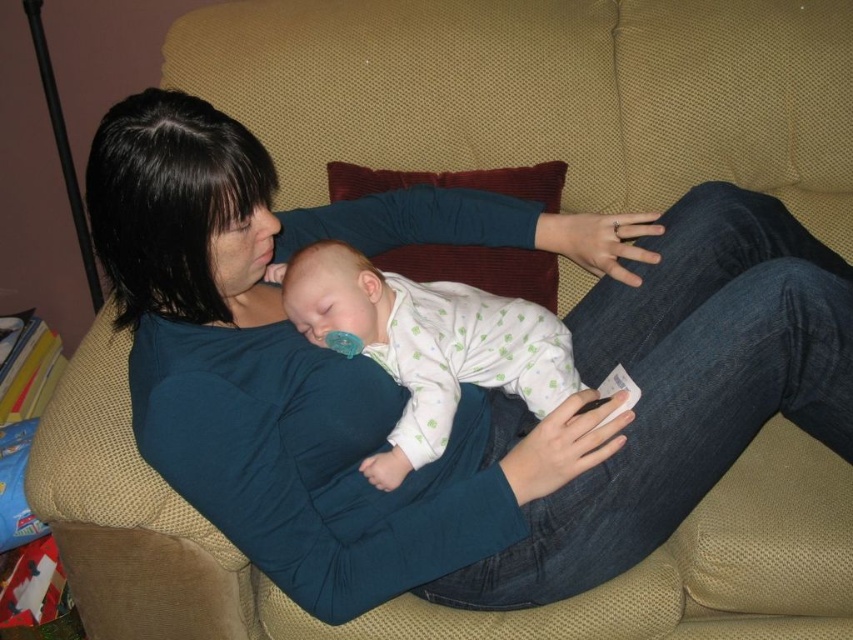
Question: Can you confirm if matte blue shirt at center is positioned to the left of white dotted fabric at center?

Choices:
 (A) no
 (B) yes

Answer: (A)

Question: Which of the following is the farthest from the observer?

Choices:
 (A) tap(584, 323)
 (B) tap(318, 326)

Answer: (A)

Question: In this image, where is matte blue shirt at center located relative to white dotted fabric at center?

Choices:
 (A) right
 (B) left

Answer: (A)

Question: Which point is closer to the camera taking this photo?

Choices:
 (A) (325, 289)
 (B) (583, 321)

Answer: (A)

Question: Can you confirm if matte blue shirt at center is bigger than white dotted fabric at center?

Choices:
 (A) yes
 (B) no

Answer: (A)